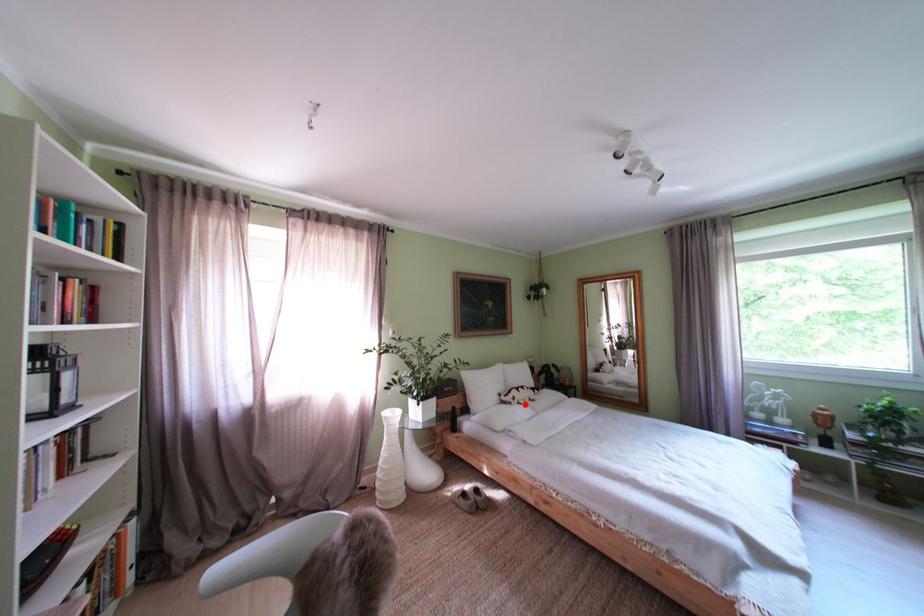
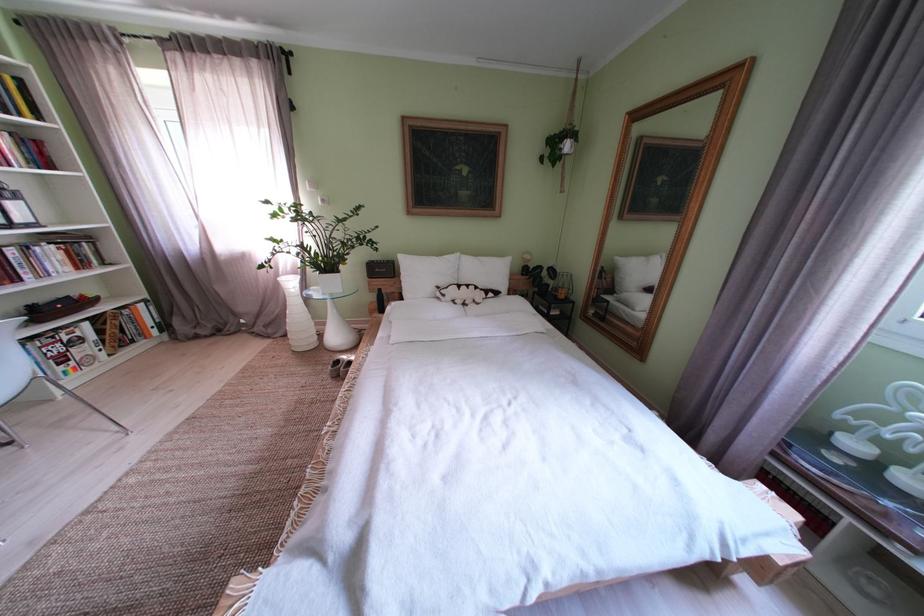
Question: I am providing you with two images of the same scene from different viewpoints. In image1, a red point is highlighted. Considering the same 3D point in image2, which of the following is correct?

Choices:
 (A) It is closer
 (B) It is farther

Answer: (A)